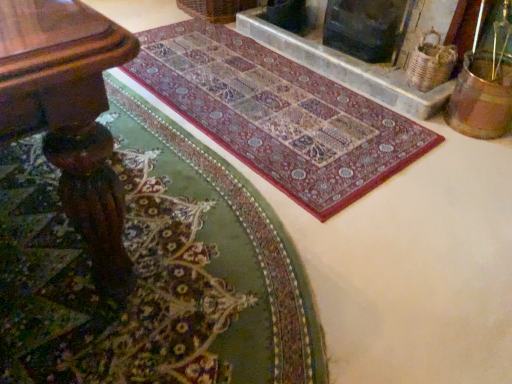
Question: From the image's perspective, does multicolored woven rug at center, marked as the first mat in a front-to-back arrangement, appear lower than marble fireplace at upper center, which ranks as the 1th fireplace in left-to-right order?

Choices:
 (A) yes
 (B) no

Answer: (A)

Question: From the image's perspective, is multicolored woven rug at center, which is counted as the second mat, starting from the back, on top of marble fireplace at upper center, which ranks as the 1th fireplace in left-to-right order?

Choices:
 (A) no
 (B) yes

Answer: (A)

Question: Considering the relative positions of multicolored woven rug at center, which is counted as the second mat, starting from the back, and marble fireplace at upper center, which is the second fireplace in right-to-left order, in the image provided, is multicolored woven rug at center, which is counted as the second mat, starting from the back, in front of marble fireplace at upper center, which is the second fireplace in right-to-left order,?

Choices:
 (A) yes
 (B) no

Answer: (A)

Question: Is multicolored woven rug at center, which is counted as the second mat, starting from the back, completely or partially outside of marble fireplace at upper center, which ranks as the 1th fireplace in left-to-right order?

Choices:
 (A) no
 (B) yes

Answer: (B)

Question: Is marble fireplace at upper center, which ranks as the 1th fireplace in left-to-right order, inside multicolored woven rug at center, marked as the first mat in a front-to-back arrangement?

Choices:
 (A) yes
 (B) no

Answer: (B)

Question: In terms of width, does carpet with intricate patterns at center, the 2th mat in the front-to-back sequence, look wider or thinner when compared to dark gray stone fireplace at upper center, which is the second fireplace in left-to-right order?

Choices:
 (A) thin
 (B) wide

Answer: (B)

Question: Relative to dark gray stone fireplace at upper center, which is the second fireplace in left-to-right order, is carpet with intricate patterns at center, the 2th mat in the front-to-back sequence, in front or behind?

Choices:
 (A) front
 (B) behind

Answer: (A)

Question: From a real-world perspective, relative to dark gray stone fireplace at upper center, acting as the first fireplace starting from the right, is carpet with intricate patterns at center, the 2th mat in the front-to-back sequence, vertically above or below?

Choices:
 (A) below
 (B) above

Answer: (A)

Question: Is carpet with intricate patterns at center, the 1th mat in the back-to-front sequence, to the left or to the right of dark gray stone fireplace at upper center, acting as the first fireplace starting from the right, in the image?

Choices:
 (A) left
 (B) right

Answer: (A)

Question: Relative to wooden table at lower left, is marble fireplace at upper center, which ranks as the 1th fireplace in left-to-right order, in front or behind?

Choices:
 (A) front
 (B) behind

Answer: (B)

Question: Considering the positions of point (475, 11) and point (105, 210), is point (475, 11) closer or farther from the camera than point (105, 210)?

Choices:
 (A) closer
 (B) farther

Answer: (B)

Question: Visually, is marble fireplace at upper center, which is the second fireplace in right-to-left order, positioned to the left or to the right of wooden table at lower left?

Choices:
 (A) left
 (B) right

Answer: (B)

Question: From a real-world perspective, is marble fireplace at upper center, which ranks as the 1th fireplace in left-to-right order, positioned above or below wooden table at lower left?

Choices:
 (A) below
 (B) above

Answer: (A)

Question: From the image's perspective, is wooden table at lower left above or below multicolored woven rug at center, marked as the first mat in a front-to-back arrangement?

Choices:
 (A) below
 (B) above

Answer: (B)

Question: Is point 78,97 positioned closer to the camera than point 164,354?

Choices:
 (A) farther
 (B) closer

Answer: (B)